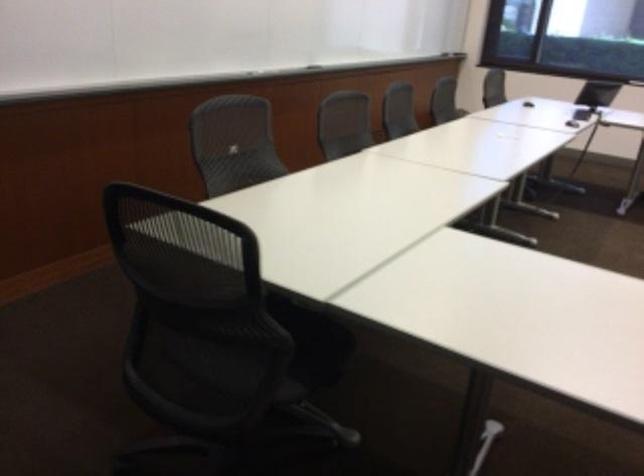
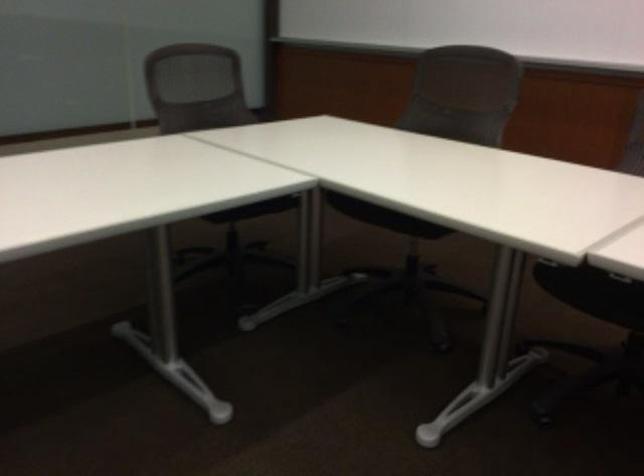
Locate, in the second image, the point that corresponds to pixel 342 355 in the first image.

(254, 209)